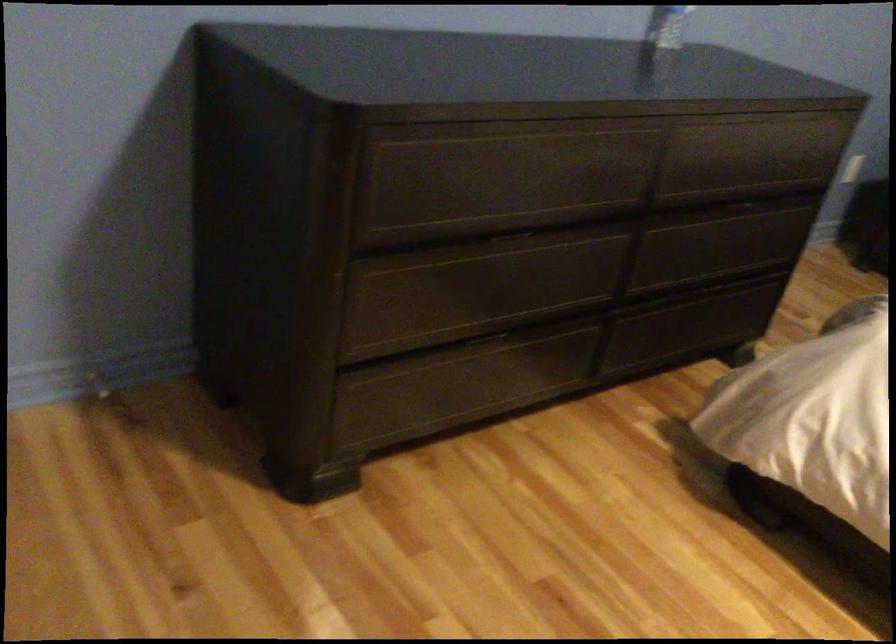
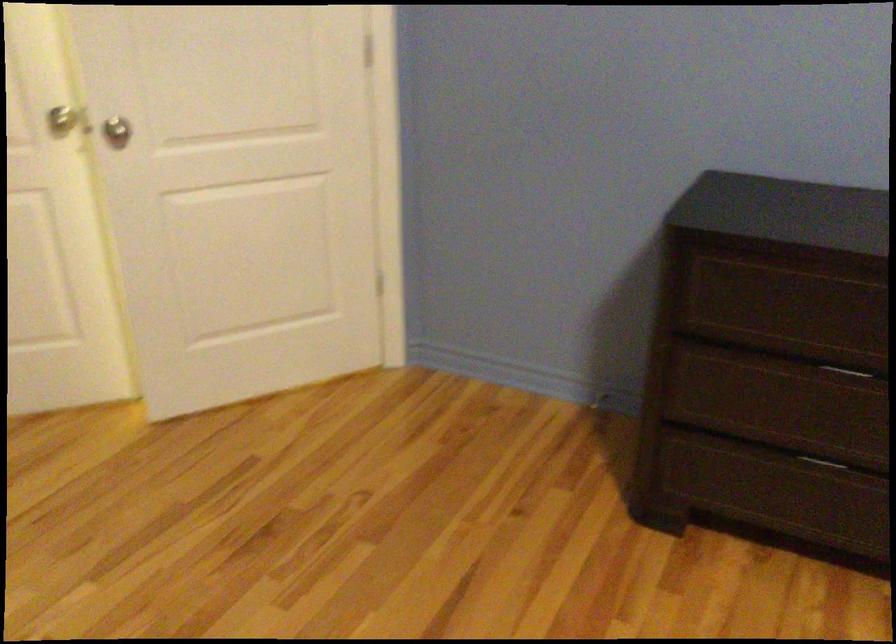
The point at [495,240] is marked in the first image. Where is the corresponding point in the second image?

(850, 371)